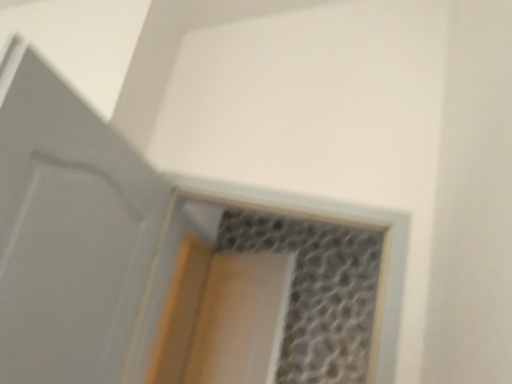
Question: Considering the positions of point (360, 241) and point (250, 357), is point (360, 241) closer or farther from the camera than point (250, 357)?

Choices:
 (A) closer
 (B) farther

Answer: (B)

Question: From the image's perspective, is translucent glass window at center located above or below clear plastic screen door at center?

Choices:
 (A) above
 (B) below

Answer: (A)

Question: Considering the real-world distances, which object is closest to the translucent glass window at center?

Choices:
 (A) clear plastic screen door at center
 (B) white matte door at left

Answer: (A)

Question: Which is farther from the white matte door at left?

Choices:
 (A) translucent glass window at center
 (B) clear plastic screen door at center

Answer: (B)